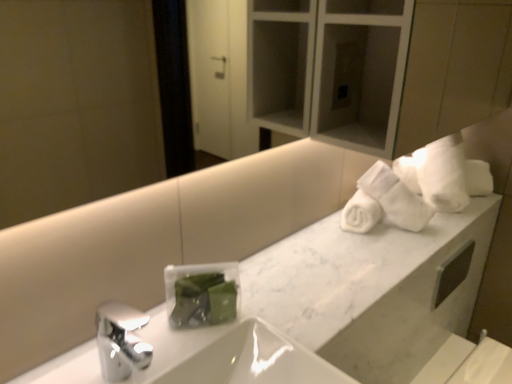
Question: Is white glossy sink at center further to camera compared to white marble counter at upper right?

Choices:
 (A) yes
 (B) no

Answer: (B)

Question: Considering the relative sizes of white glossy sink at center and white marble counter at upper right in the image provided, is white glossy sink at center taller than white marble counter at upper right?

Choices:
 (A) yes
 (B) no

Answer: (A)

Question: Is white glossy sink at center facing away from white marble counter at upper right?

Choices:
 (A) yes
 (B) no

Answer: (B)

Question: Is white glossy sink at center completely or partially outside of white marble counter at upper right?

Choices:
 (A) no
 (B) yes

Answer: (B)

Question: From the image's perspective, is white glossy sink at center above white marble counter at upper right?

Choices:
 (A) no
 (B) yes

Answer: (A)

Question: Is white marble counter at upper right bigger or smaller than white glossy sink at center?

Choices:
 (A) big
 (B) small

Answer: (B)

Question: From the image's perspective, is white marble counter at upper right above or below white glossy sink at center?

Choices:
 (A) above
 (B) below

Answer: (A)

Question: From their relative heights in the image, would you say white marble counter at upper right is taller or shorter than white glossy sink at center?

Choices:
 (A) short
 (B) tall

Answer: (A)

Question: Looking at their shapes, would you say white marble counter at upper right is wider or thinner than white glossy sink at center?

Choices:
 (A) thin
 (B) wide

Answer: (A)

Question: Considering the positions of white soft towels at upper right and white glossy sink at center in the image, is white soft towels at upper right wider or thinner than white glossy sink at center?

Choices:
 (A) wide
 (B) thin

Answer: (B)

Question: Is white soft towels at upper right bigger or smaller than white glossy sink at center?

Choices:
 (A) big
 (B) small

Answer: (B)

Question: From the image's perspective, relative to white glossy sink at center, is white soft towels at upper right above or below?

Choices:
 (A) below
 (B) above

Answer: (B)

Question: In terms of height, does white soft towels at upper right look taller or shorter compared to white glossy sink at center?

Choices:
 (A) short
 (B) tall

Answer: (B)

Question: Choose the correct answer: Is white glossy sink at center inside white marble counter at upper right or outside it?

Choices:
 (A) inside
 (B) outside

Answer: (B)

Question: From a real-world perspective, is white glossy sink at center above or below white marble counter at upper right?

Choices:
 (A) below
 (B) above

Answer: (A)